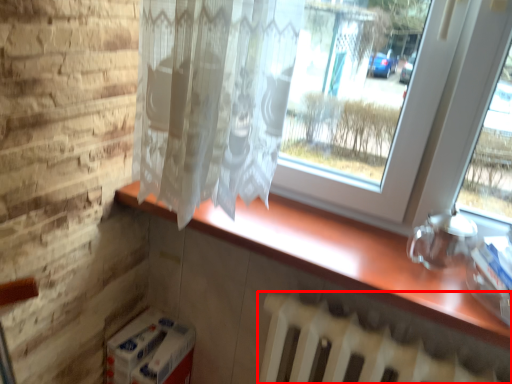
Question: From the image's perspective, what is the correct spatial positioning of radiator (annotated by the red box) in reference to counter top?

Choices:
 (A) above
 (B) below

Answer: (B)